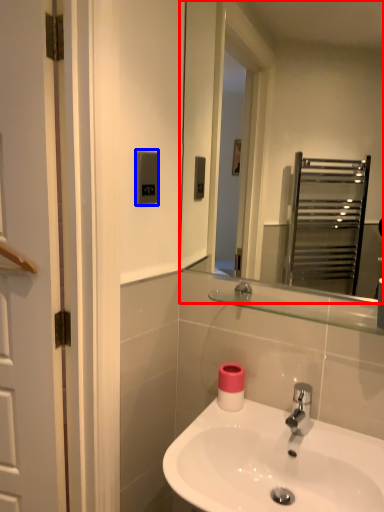
Question: Which object is further to the camera taking this photo, mirror (highlighted by a red box) or light switch (highlighted by a blue box)?

Choices:
 (A) mirror
 (B) light switch

Answer: (B)